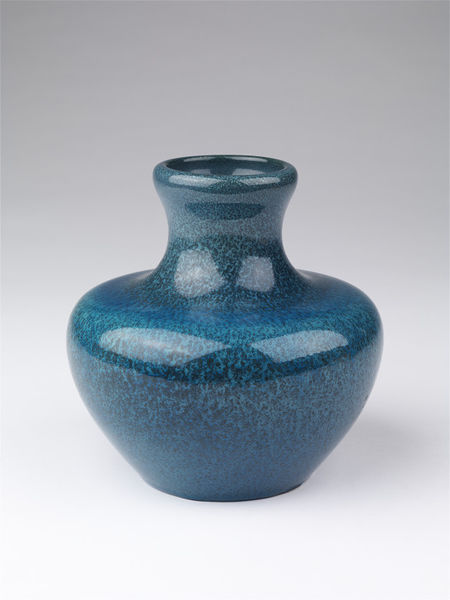
At what (x,y) coordinates should I click in order to perform the action: click on pot. Please return your answer as a coordinate pair (x, y). The image size is (450, 600). Looking at the image, I should click on (234, 418).